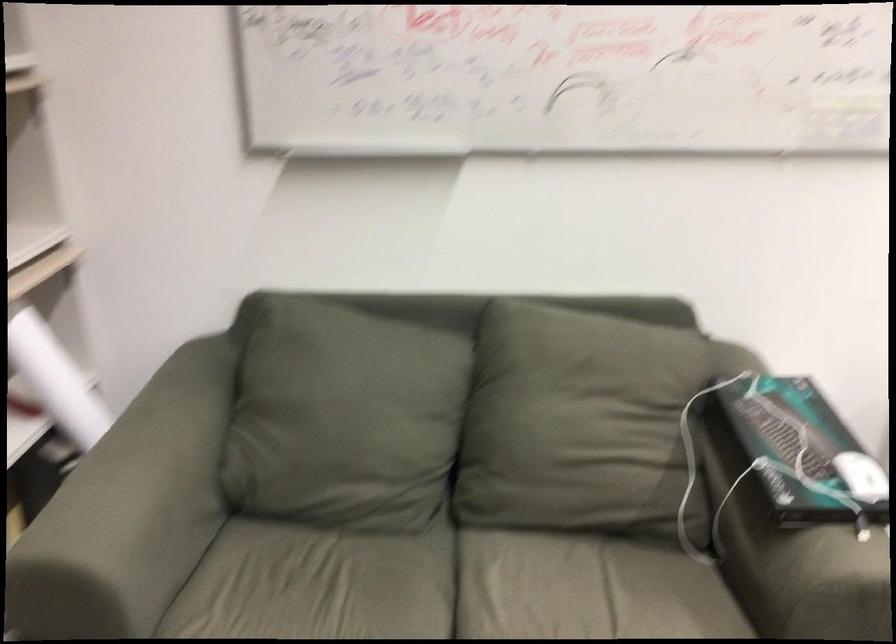
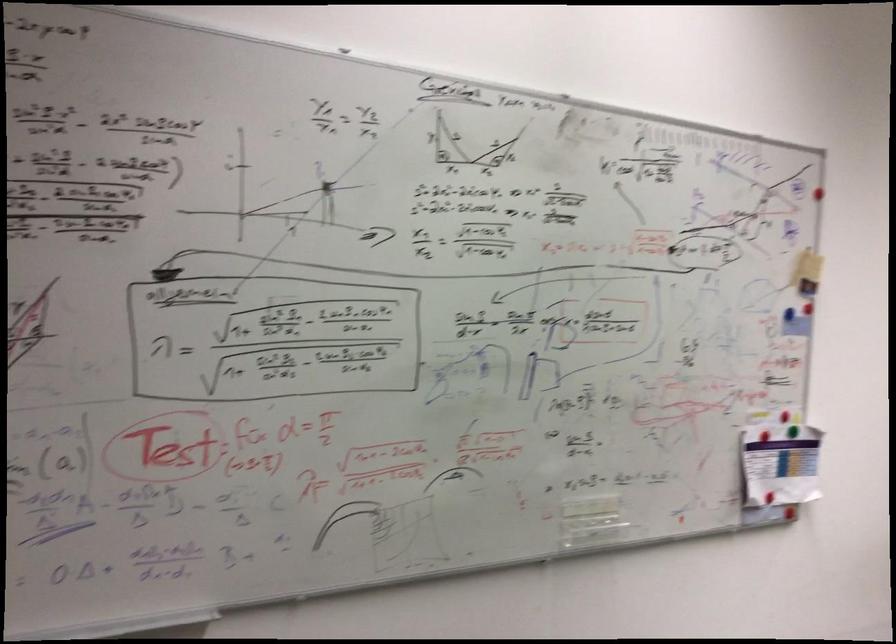
How did the camera likely rotate?

The camera rotated toward right-up.